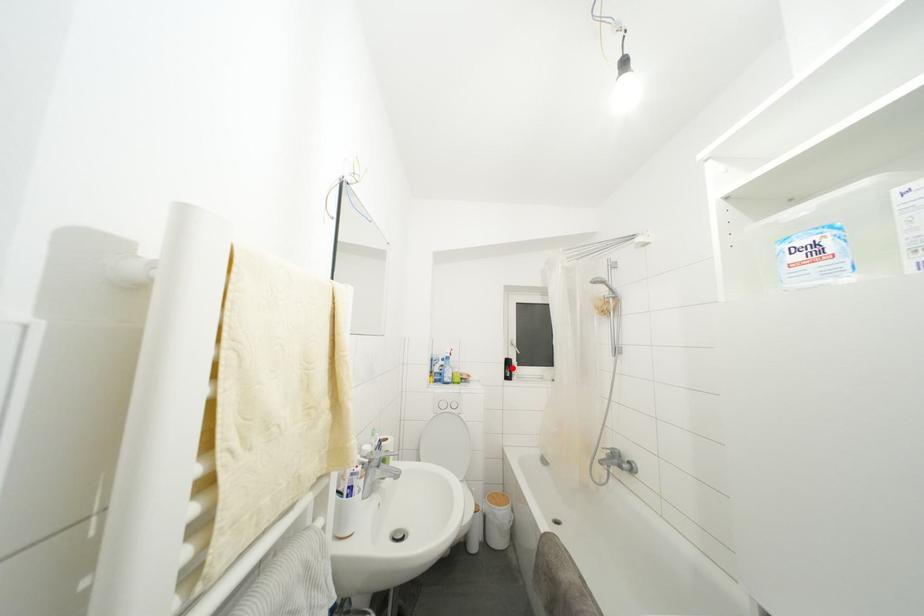
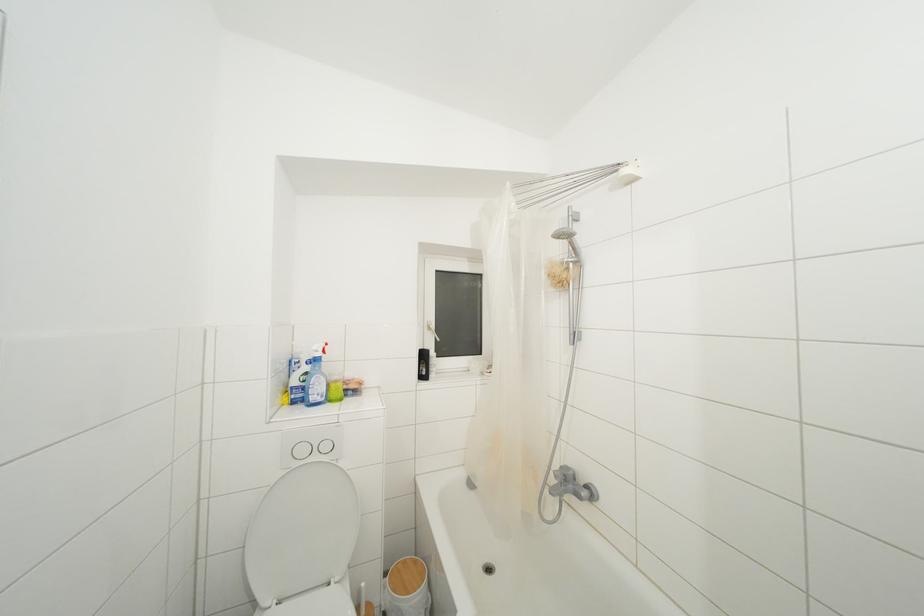
In the second image, find the point that corresponds to the highlighted location in the first image.

(428, 361)